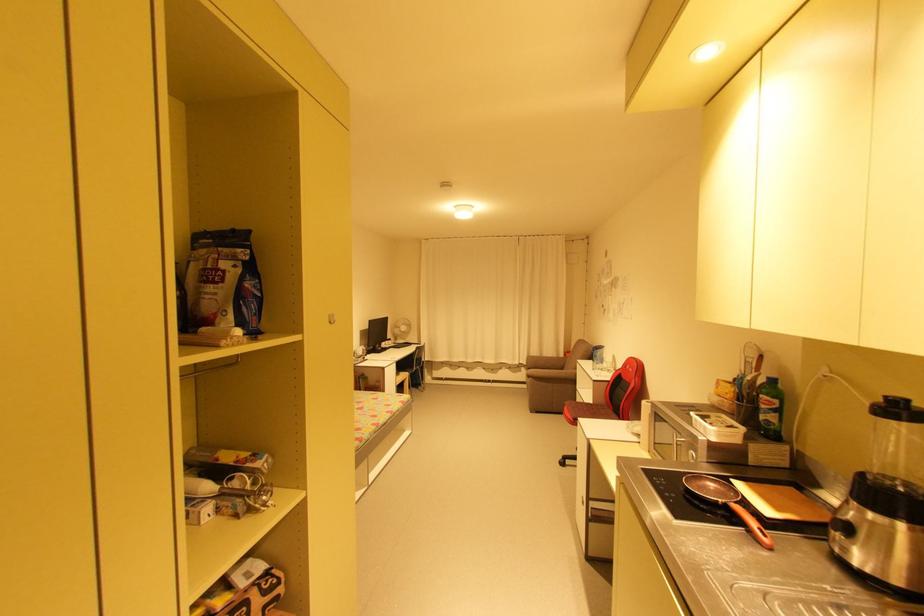
Which object does [885,505] point to?

It refers to a blender pitcher.